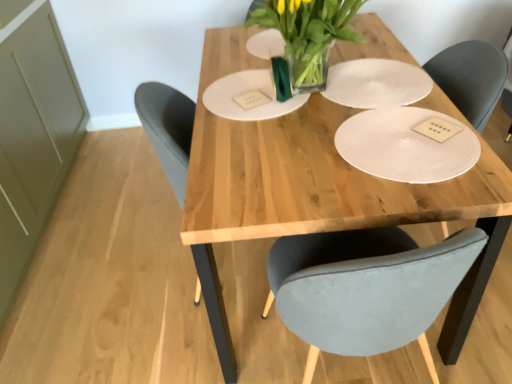
The image size is (512, 384). I want to click on vacant region in front of white matte paper plate at center, which is counted as the 1th paper plate, starting from the left, so (260, 155).